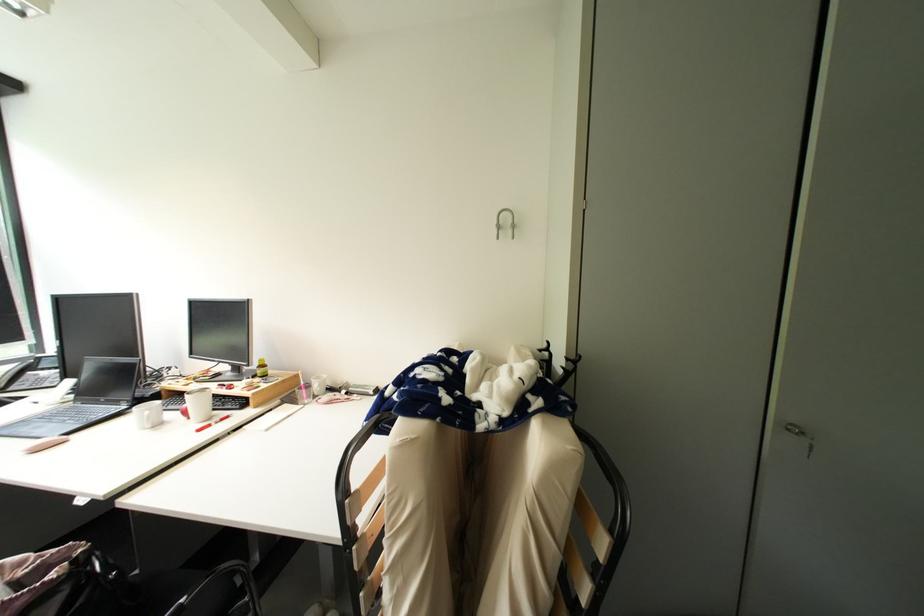
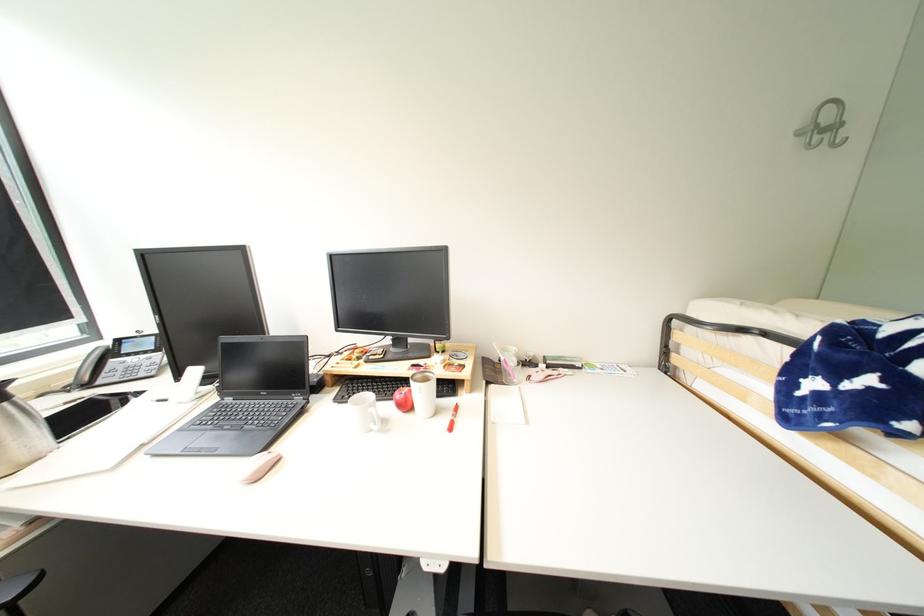
The point at [35,451] is marked in the first image. Where is the corresponding point in the second image?

(254, 480)